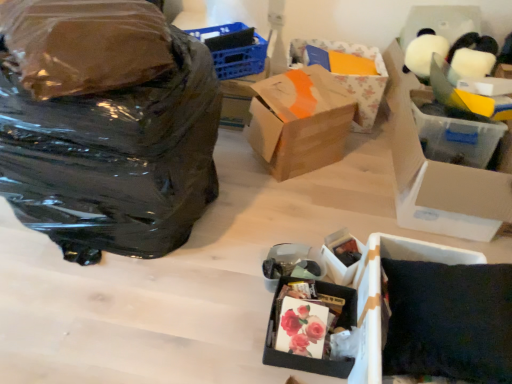
Locate an element on the screen. free region on the left part of white cardboard box at upper right, which ranks as the third box in bottom-to-top order is located at coordinates (338, 195).